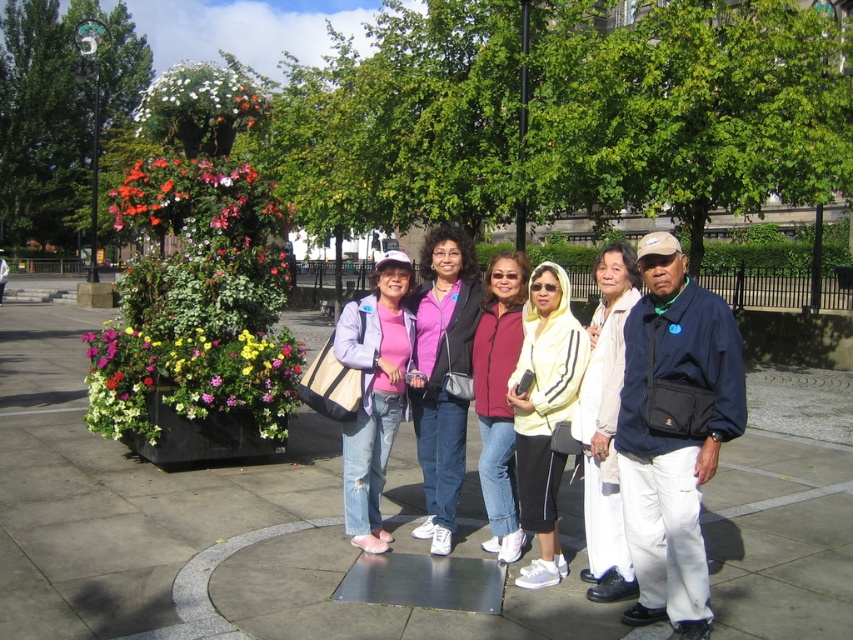
Question: Does matte pink sweater at center have a greater width compared to white cotton pants at center?

Choices:
 (A) yes
 (B) no

Answer: (A)

Question: Which object is the farthest from the maroon fleece jacket at center?

Choices:
 (A) matte pink sweater at center
 (B) matte purple jacket at center
 (C) white cotton pants at center

Answer: (C)

Question: Does metallic silver pavement at center lie behind yellow/white striped hoodie at center?

Choices:
 (A) no
 (B) yes

Answer: (A)

Question: Considering the real-world distances, which object is farthest from the yellow/white striped hoodie at center?

Choices:
 (A) matte pink sweater at center
 (B) metallic silver pavement at center
 (C) matte purple jacket at center

Answer: (B)

Question: Is matte purple jacket at center wider than white cotton pants at center?

Choices:
 (A) no
 (B) yes

Answer: (B)

Question: Which object appears closest to the camera in this image?

Choices:
 (A) matte pink sweater at center
 (B) metallic silver pavement at center

Answer: (B)